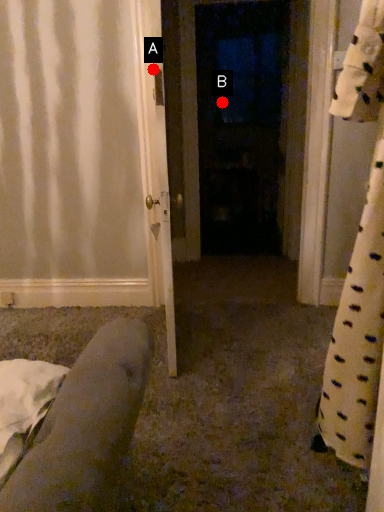
Question: Two points are circled on the image, labeled by A and B beside each circle. Which point is further to the camera?

Choices:
 (A) A is further
 (B) B is further

Answer: (B)